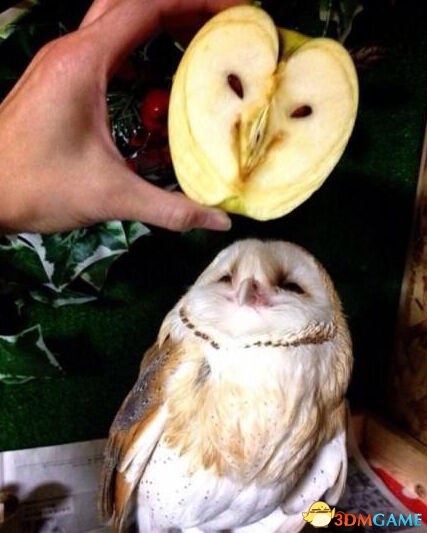
At what (x,y) coordinates should I click in order to perform the action: click on newspaper. Please return your answer as a coordinate pair (x, y). Looking at the image, I should click on (80, 473).